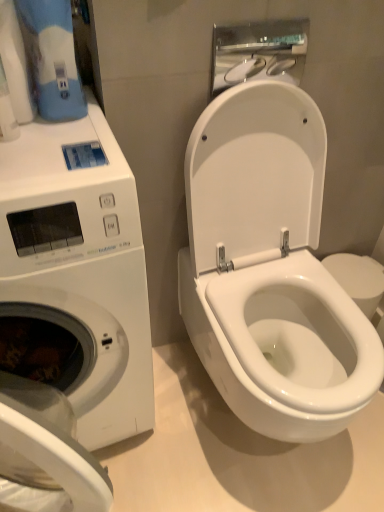
Question: From a real-world perspective, relative to white glossy toilet paper at upper left, is white glossy toilet at center vertically above or below?

Choices:
 (A) above
 (B) below

Answer: (B)

Question: From the image's perspective, is white glossy toilet at center above or below white glossy toilet paper at upper left?

Choices:
 (A) above
 (B) below

Answer: (B)

Question: Which is farther from the white glossy toilet at center?

Choices:
 (A) white glossy toilet paper at upper left
 (B) white glossy hand dryer at upper center
 (C) white glossy washing machine at left

Answer: (A)

Question: Estimate the real-world distances between objects in this image. Which object is farther from the white glossy toilet at center?

Choices:
 (A) white glossy hand dryer at upper center
 (B) white glossy washing machine at left
 (C) white glossy toilet paper at upper left

Answer: (C)